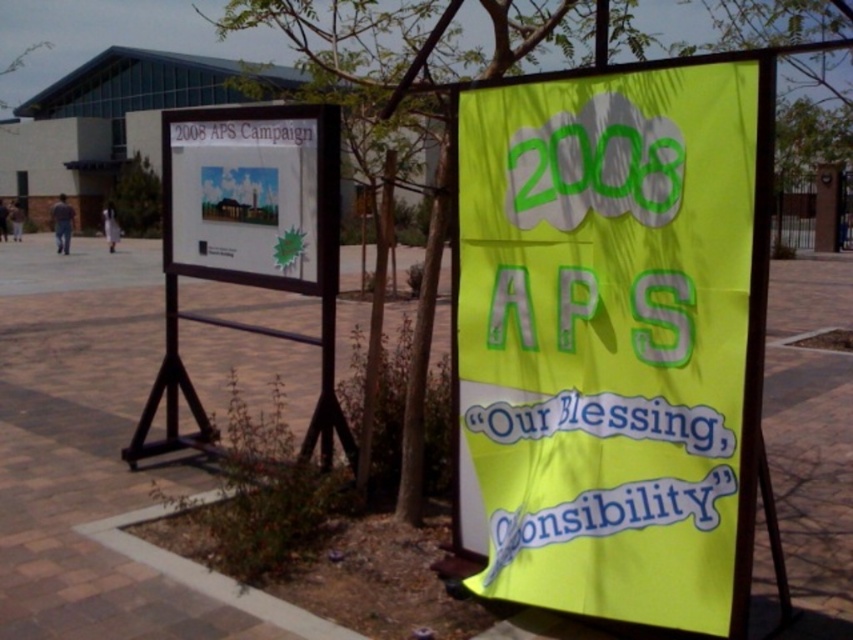
Question: Based on their relative distances, which object is farther from the yellow fabric banner at center?

Choices:
 (A) yellow paper at center
 (B) green leafy tree at center

Answer: (B)

Question: Which point appears closest to the camera in this image?

Choices:
 (A) (x=776, y=496)
 (B) (x=618, y=67)
 (C) (x=242, y=264)
 (D) (x=665, y=605)

Answer: (D)

Question: Does yellow fabric banner at center have a larger size compared to green leafy tree at center?

Choices:
 (A) no
 (B) yes

Answer: (A)

Question: Which of the following is the farthest from the observer?

Choices:
 (A) white paper poster at upper left
 (B) green leafy tree at center
 (C) yellow fabric banner at center

Answer: (A)

Question: Is yellow fabric banner at center thinner than green leafy tree at center?

Choices:
 (A) no
 (B) yes

Answer: (A)

Question: In this image, where is yellow paper at center located relative to green leafy tree at center?

Choices:
 (A) below
 (B) above

Answer: (A)